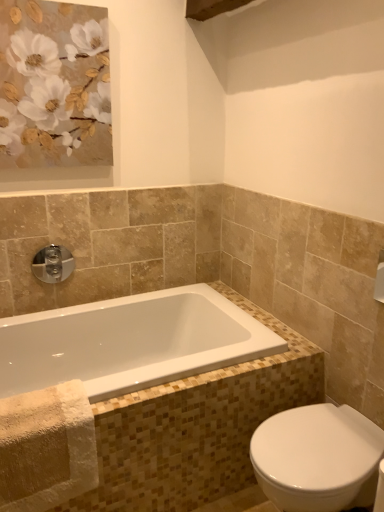
Question: Should I look upward or downward to see white glossy bidet at lower right?

Choices:
 (A) down
 (B) up

Answer: (A)

Question: Is matte gold flowers at upper left at the left side of white glossy bidet at lower right?

Choices:
 (A) yes
 (B) no

Answer: (A)

Question: Is matte gold flowers at upper left oriented away from white glossy bidet at lower right?

Choices:
 (A) no
 (B) yes

Answer: (A)

Question: From a real-world perspective, is matte gold flowers at upper left beneath white glossy bidet at lower right?

Choices:
 (A) no
 (B) yes

Answer: (A)

Question: Is matte gold flowers at upper left surrounding white glossy bidet at lower right?

Choices:
 (A) no
 (B) yes

Answer: (A)

Question: From the image's perspective, is matte gold flowers at upper left beneath white glossy bidet at lower right?

Choices:
 (A) no
 (B) yes

Answer: (A)

Question: Is matte gold flowers at upper left behind white glossy bidet at lower right?

Choices:
 (A) yes
 (B) no

Answer: (A)

Question: Considering the relative sizes of chrome/metallic faucet at upper left and matte gold flowers at upper left in the image provided, is chrome/metallic faucet at upper left bigger than matte gold flowers at upper left?

Choices:
 (A) yes
 (B) no

Answer: (B)

Question: Is chrome/metallic faucet at upper left shorter than matte gold flowers at upper left?

Choices:
 (A) no
 (B) yes

Answer: (B)

Question: Would you say chrome/metallic faucet at upper left is outside matte gold flowers at upper left?

Choices:
 (A) no
 (B) yes

Answer: (B)

Question: From a real-world perspective, does chrome/metallic faucet at upper left stand above matte gold flowers at upper left?

Choices:
 (A) no
 (B) yes

Answer: (A)

Question: Is chrome/metallic faucet at upper left with matte gold flowers at upper left?

Choices:
 (A) no
 (B) yes

Answer: (A)

Question: Is chrome/metallic faucet at upper left smaller than matte gold flowers at upper left?

Choices:
 (A) yes
 (B) no

Answer: (A)

Question: From a real-world perspective, is chrome/metallic faucet at upper left positioned over white glossy bidet at lower right based on gravity?

Choices:
 (A) yes
 (B) no

Answer: (A)